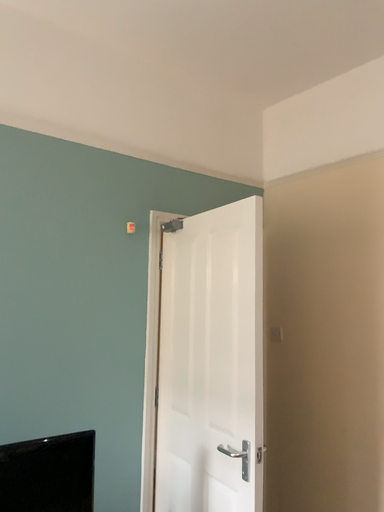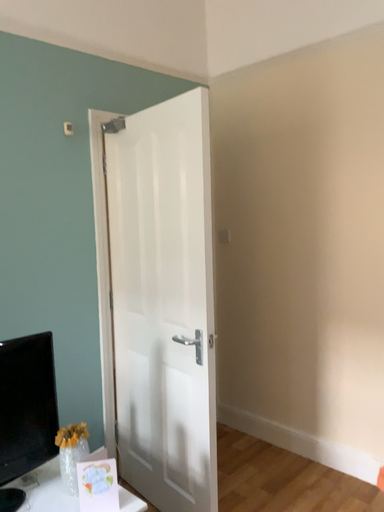
Question: How did the camera likely rotate when shooting the video?

Choices:
 (A) rotated downward
 (B) rotated upward

Answer: (A)